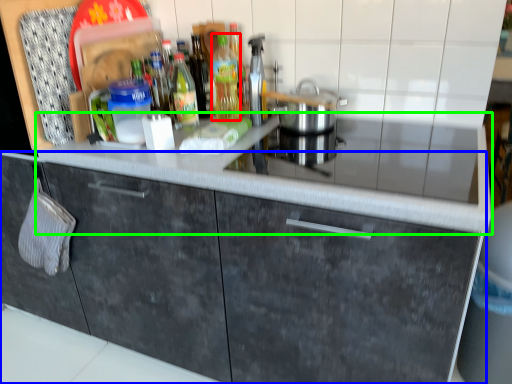
Question: Estimate the real-world distances between objects in this image. Which object is closer to bottle (highlighted by a red box), cabinetry (highlighted by a blue box) or countertop (highlighted by a green box)?

Choices:
 (A) cabinetry
 (B) countertop

Answer: (B)